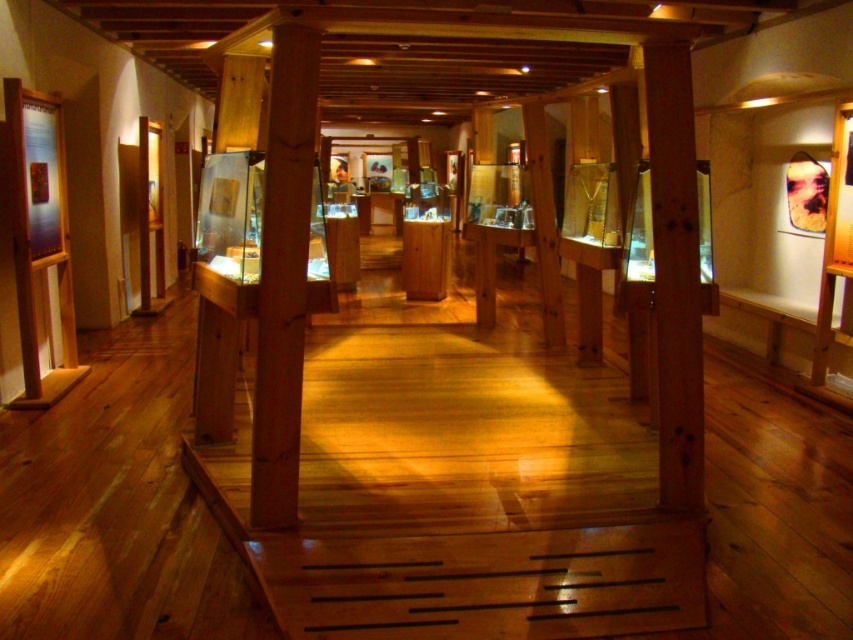
You are standing in the museum and see two points marked in the image. The first point is at coordinates point (299,259) and the second is at point (677,128). Which point is closer to you?

Point (299,259) is closer to the viewer than point (677,128).

Looking at this image, you are an architect designing a new exhibit layout and need to place a large sculpture between the natural wood column at center and the wooden post at center. Given their sizes, will there be enough space to fit the sculpture between them?

The natural wood column at center occupies less space than the wooden post at center. Therefore, there is sufficient space between them to accommodate the large sculpture.